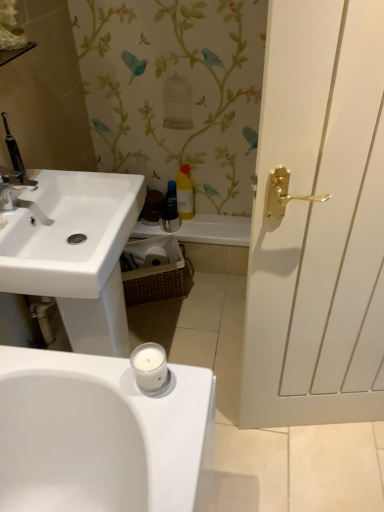
In order to click on unoccupied region to the right of yellow matte bottle at center, marked as the second toiletry in a left-to-right arrangement in this screenshot , I will do `click(219, 220)`.